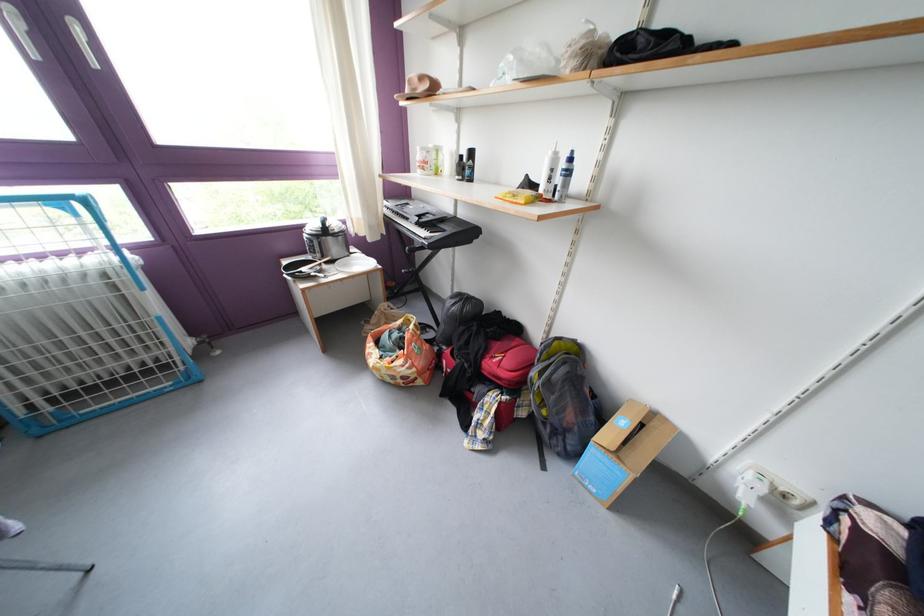
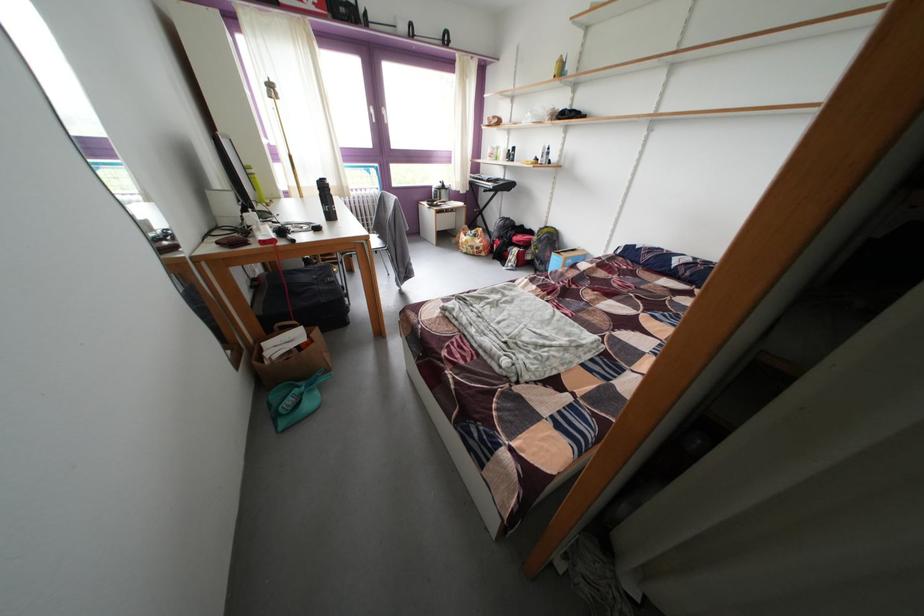
Where in the second image is the point corresponding to point (381, 352) from the first image?

(472, 241)